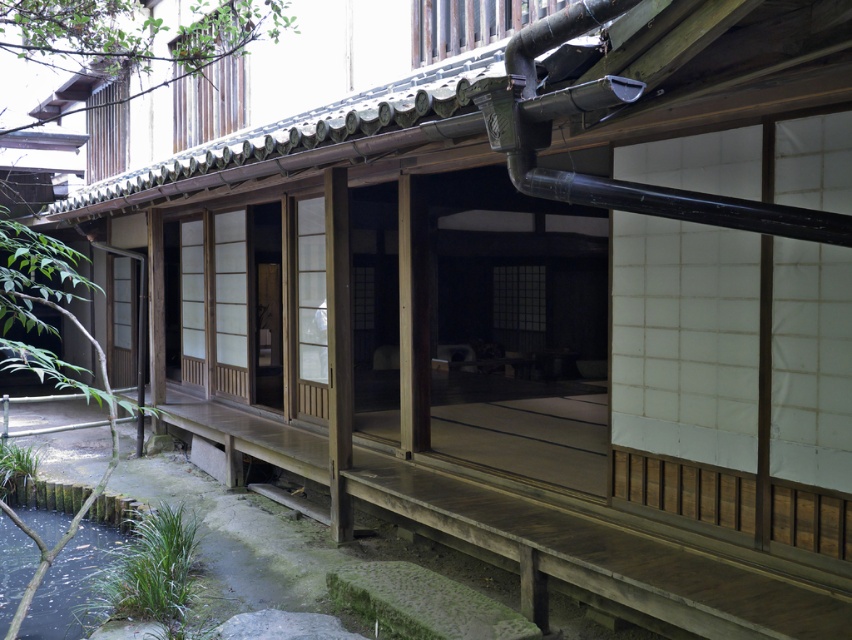
Can you confirm if green mossy pond at lower left is taller than wooden shoji screen at center?

Incorrect, green mossy pond at lower left's height is not larger of wooden shoji screen at center's.

At what (x,y) coordinates should I click in order to perform the action: click on green mossy pond at lower left. Please return your answer as a coordinate pair (x, y). Image resolution: width=852 pixels, height=640 pixels. Looking at the image, I should click on (70, 582).